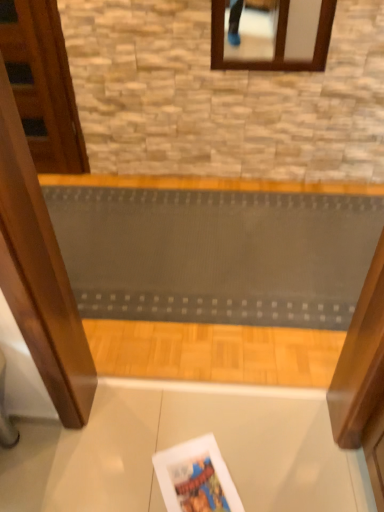
Question: Is textured gray ramp at center closer to the viewer compared to matte paper magazine at lower center?

Choices:
 (A) no
 (B) yes

Answer: (A)

Question: Would you say textured gray ramp at center is a long distance from matte paper magazine at lower center?

Choices:
 (A) yes
 (B) no

Answer: (B)

Question: Is textured gray ramp at center turned away from matte paper magazine at lower center?

Choices:
 (A) yes
 (B) no

Answer: (B)

Question: From the image's perspective, is textured gray ramp at center over matte paper magazine at lower center?

Choices:
 (A) yes
 (B) no

Answer: (A)

Question: From a real-world perspective, is textured gray ramp at center positioned over matte paper magazine at lower center based on gravity?

Choices:
 (A) yes
 (B) no

Answer: (A)

Question: From the image's perspective, is wooden door at left located above or below textured gray ramp at center?

Choices:
 (A) below
 (B) above

Answer: (B)

Question: In the image, is wooden door at left positioned in front of or behind textured gray ramp at center?

Choices:
 (A) behind
 (B) front

Answer: (A)

Question: Based on their positions, is wooden door at left located to the left or right of textured gray ramp at center?

Choices:
 (A) left
 (B) right

Answer: (A)

Question: From a real-world perspective, is wooden door at left above or below textured gray ramp at center?

Choices:
 (A) above
 (B) below

Answer: (A)

Question: From a real-world perspective, is wooden door at left above or below matte paper magazine at lower center?

Choices:
 (A) above
 (B) below

Answer: (A)

Question: Would you say wooden door at left is to the left or to the right of matte paper magazine at lower center in the picture?

Choices:
 (A) right
 (B) left

Answer: (B)

Question: Is wooden door at left bigger or smaller than matte paper magazine at lower center?

Choices:
 (A) big
 (B) small

Answer: (A)

Question: Is point (34, 159) positioned closer to the camera than point (188, 478)?

Choices:
 (A) farther
 (B) closer

Answer: (A)

Question: Is point (81, 256) closer or farther from the camera than point (69, 155)?

Choices:
 (A) farther
 (B) closer

Answer: (B)

Question: Considering the positions of textured gray ramp at center and wooden door at left in the image, is textured gray ramp at center wider or thinner than wooden door at left?

Choices:
 (A) thin
 (B) wide

Answer: (B)